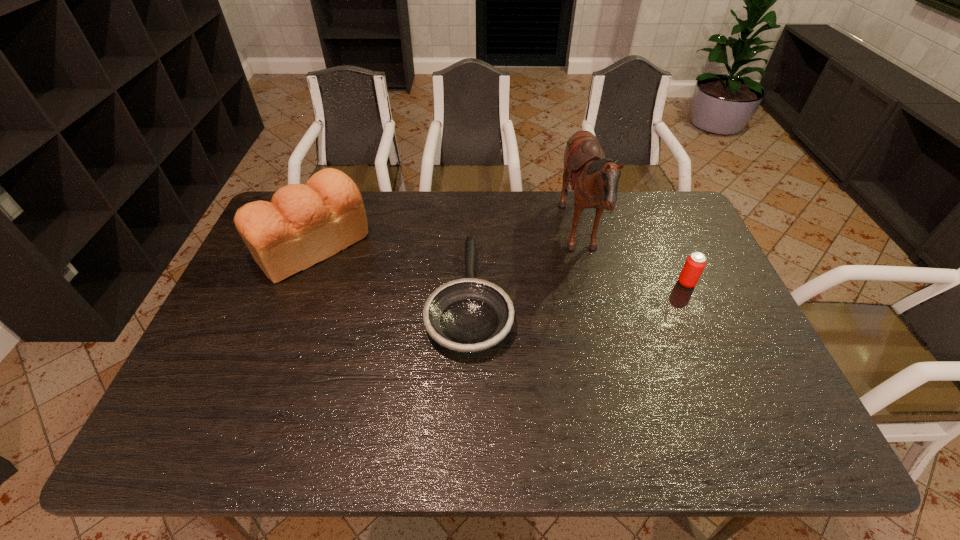
Where is `free space that satisfies the following two spatial constraints: 1. on the handle side of the third tallest object; 2. on the left side of the frying pan`? Image resolution: width=960 pixels, height=540 pixels. free space that satisfies the following two spatial constraints: 1. on the handle side of the third tallest object; 2. on the left side of the frying pan is located at coordinates (469, 283).

Find the location of a particular element. This screenshot has width=960, height=540. free point that satisfies the following two spatial constraints: 1. on the handle side of the shortest object; 2. on the left side of the third tallest object is located at coordinates (469, 283).

At what (x,y) coordinates should I click in order to perform the action: click on free space that satisfies the following two spatial constraints: 1. on the back of the second object from right to left; 2. on the right side of the rightmost object. Please return your answer as a coordinate pair (x, y). This screenshot has height=540, width=960. Looking at the image, I should click on (590, 283).

Identify the location of free location that satisfies the following two spatial constraints: 1. on the handle side of the rightmost object; 2. on the right side of the second object from left to right. (469, 283).

I want to click on free space in the image that satisfies the following two spatial constraints: 1. on the back of the tallest object; 2. on the back side of the rightmost object, so click(590, 283).

Locate an element on the screen. This screenshot has height=540, width=960. free space that satisfies the following two spatial constraints: 1. on the back of the third tallest object; 2. on the right side of the third object from left to right is located at coordinates (590, 283).